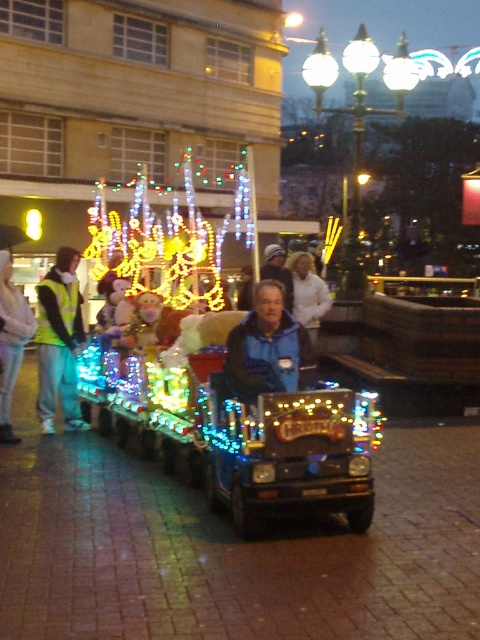
You are a photographer at the event and need to capture both the blue fleece jacket at center and the blue fabric jacket at center in the same frame. Which jacket should you focus on to ensure both are visible without zooming in or out?

You should focus on the blue fleece jacket at center because it is smaller than the blue fabric jacket at center, allowing both to fit within the frame more easily.

You are organizing a photo shoot for the Christmas event and need to ensure that all participants are visible in the group photo. The blue fleece jacket at center and the blue fabric jacket at center are both in the frame. Which jacket should you focus on to ensure visibility due to its size?

The blue fleece jacket at center should be focused on because its width surpasses that of the blue fabric jacket at center, making it more visible in the photo.